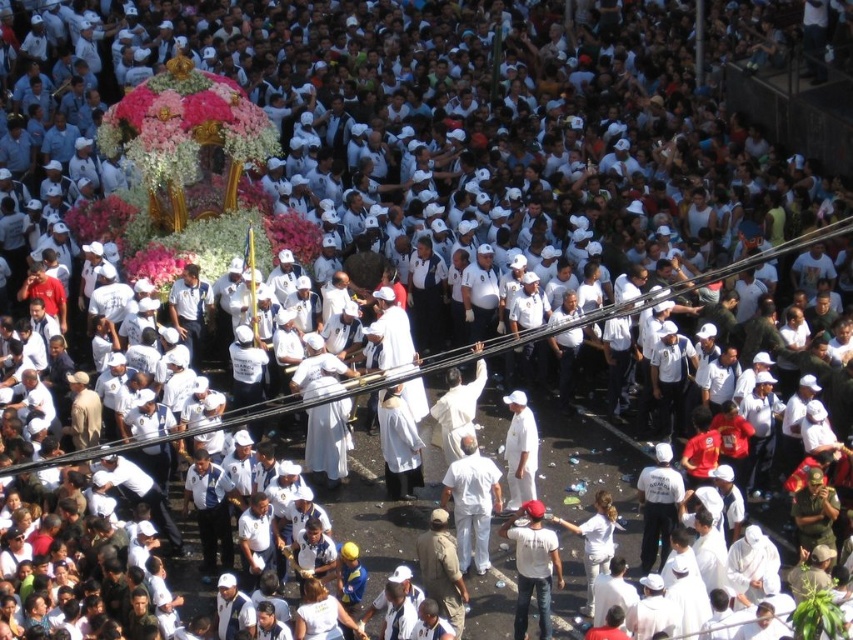
You are a photographer trying to capture a photo of the white matte clothing at center and the white cotton shirt at lower right. Which one is positioned to the left of the other in the image?

The white matte clothing at center is positioned on the left side of white cotton shirt at lower right.

You are a photographer at the event and want to capture the white matte clothing at center in your shot. Where should you position your camera to ensure it is centered in the frame?

To center the white matte clothing at center in your shot, position your camera at point (x=473, y=502).

You are a photographer positioned at the center of the event. You want to capture both the point at (463, 438) and the point at (541, 592) in your photo. Which point should you focus on to ensure both are in sharp focus?

To ensure both points are in sharp focus, you should focus on the point that is farther from the camera, which is point (463, 438). This is because the depth of field will extend from that point backward, potentially keeping both in focus.